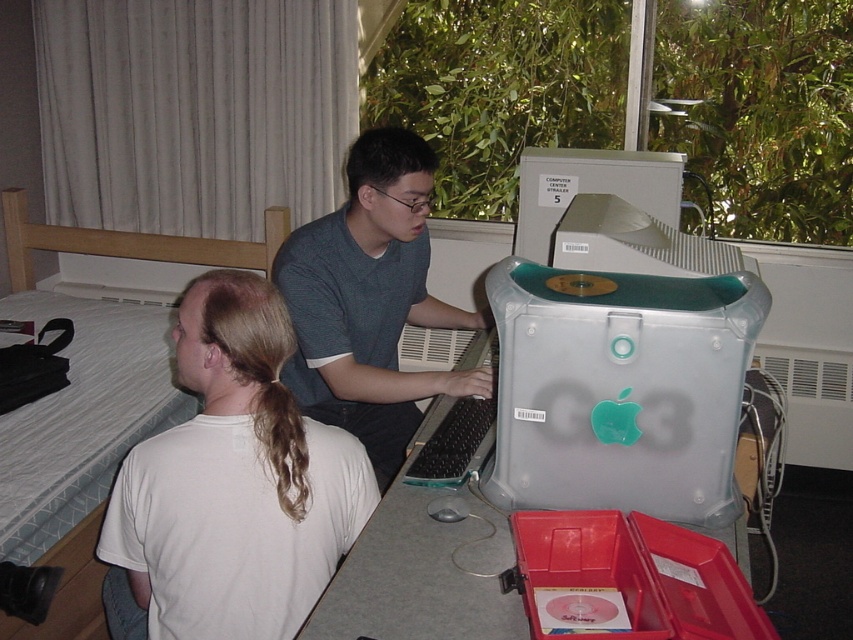
Question: Which of the following is the closest to the observer?

Choices:
 (A) (62, 234)
 (B) (398, 515)

Answer: (B)

Question: Based on their relative distances, which object is farther from the matte plastic computer desk at center?

Choices:
 (A) white matte shirt at back
 (B) matte gray shirt at center

Answer: (B)

Question: Estimate the real-world distances between objects in this image. Which object is closer to the matte gray shirt at center?

Choices:
 (A) matte plastic computer desk at center
 (B) gray plastic desktop computer at upper center
 (C) white quilted fabric bed at left

Answer: (A)

Question: Is white quilted fabric bed at left above gray plastic desktop computer at upper center?

Choices:
 (A) yes
 (B) no

Answer: (B)

Question: Does matte plastic computer desk at center have a smaller size compared to gray plastic desktop computer at upper center?

Choices:
 (A) yes
 (B) no

Answer: (B)

Question: Is white matte shirt at back positioned at the back of gray plastic desktop computer at upper center?

Choices:
 (A) no
 (B) yes

Answer: (A)